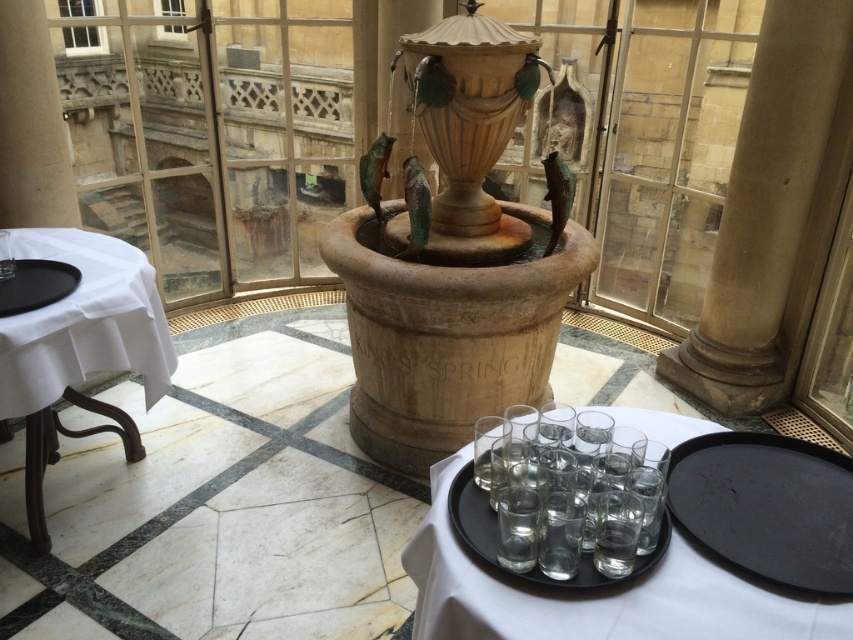
Question: Where is beige stone fountain at center located in relation to white cloth-covered table at left in the image?

Choices:
 (A) left
 (B) right

Answer: (B)

Question: Is beige stone fountain at center above black matte platter at left?

Choices:
 (A) yes
 (B) no

Answer: (A)

Question: Estimate the real-world distances between objects in this image. Which object is closer to the clear glass tray at center?

Choices:
 (A) white cloth-covered table at left
 (B) black matte platter at left
 (C) transparent glass tray at center
 (D) beige stone column at right

Answer: (C)

Question: Does beige stone fountain at center have a larger size compared to transparent glass tray at center?

Choices:
 (A) no
 (B) yes

Answer: (B)

Question: Among these objects, which one is nearest to the camera?

Choices:
 (A) clear glass tray at center
 (B) beige stone column at right
 (C) beige stone fountain at center
 (D) black matte tray at lower right

Answer: (A)

Question: Which object is farther from the camera taking this photo?

Choices:
 (A) white cloth-covered table at left
 (B) beige stone fountain at center
 (C) transparent glass tray at center

Answer: (B)